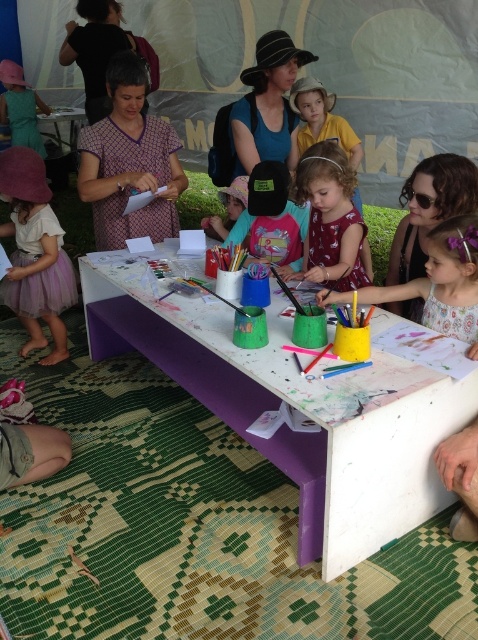
Question: Estimate the real-world distances between objects in this image. Which object is closer to the pink fabric hat at center?

Choices:
 (A) matte black cap at center
 (B) purple painted wood table at center

Answer: (A)

Question: Which of the following is the farthest from the observer?

Choices:
 (A) (24, 180)
 (B) (304, 116)
 (C) (397, 472)

Answer: (B)

Question: Does matte pink dress at center have a lesser width compared to matte blue shirt at center?

Choices:
 (A) no
 (B) yes

Answer: (B)

Question: Which point appears farthest from the camera in this image?

Choices:
 (A) (296, 100)
 (B) (234, 189)
 (C) (336, 253)

Answer: (A)

Question: Is purple tulle skirt at lower left to the left of matte blue shirt at center from the viewer's perspective?

Choices:
 (A) yes
 (B) no

Answer: (A)

Question: Does matte yellow cup at center have a lesser width compared to matte blue shirt at center?

Choices:
 (A) yes
 (B) no

Answer: (B)